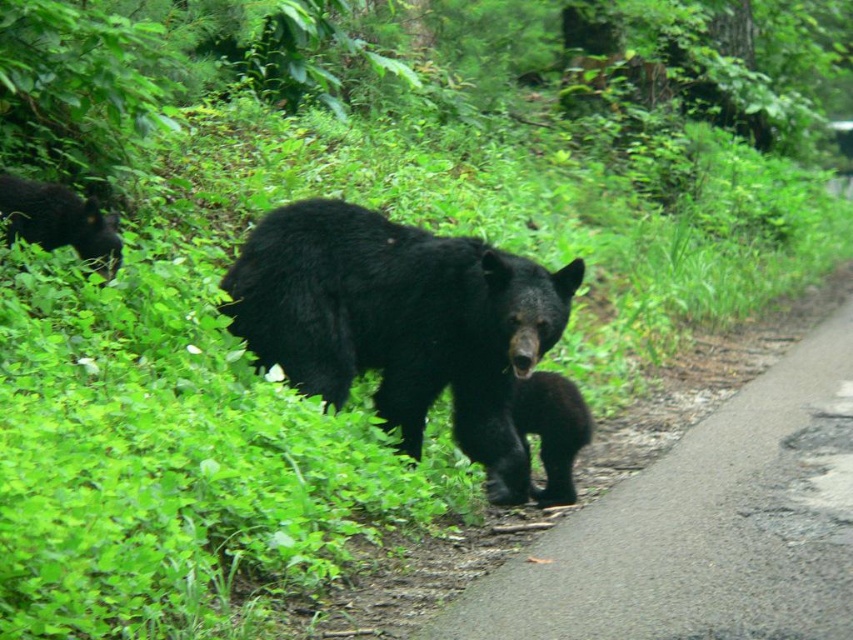
Between black furry bear at center and shiny black bear at left, which one has more height?

With more height is black furry bear at center.

How far apart are black furry bear at center and shiny black bear at left?

black furry bear at center is 4.78 feet from shiny black bear at left.

Who is more forward, (456, 401) or (22, 237)?

Positioned in front is point (456, 401).

This screenshot has height=640, width=853. In order to click on black furry bear at center in this screenshot , I will do `click(401, 323)`.

Who is positioned more to the right, black furry bear at center or black furry bear cub at center?

Positioned to the right is black furry bear cub at center.

Based on the photo, does black furry bear at center appear on the right side of black furry bear cub at center?

Incorrect, black furry bear at center is not on the right side of black furry bear cub at center.

The width and height of the screenshot is (853, 640). I want to click on black furry bear at center, so click(x=401, y=323).

Between shiny black bear at left and black furry bear cub at center, which one appears on the left side from the viewer's perspective?

From the viewer's perspective, shiny black bear at left appears more on the left side.

Can you confirm if shiny black bear at left is shorter than black furry bear cub at center?

Yes, shiny black bear at left is shorter than black furry bear cub at center.

Which is in front, point (16, 228) or point (553, 385)?

Point (16, 228)

Locate an element on the screen. shiny black bear at left is located at coordinates (59, 221).